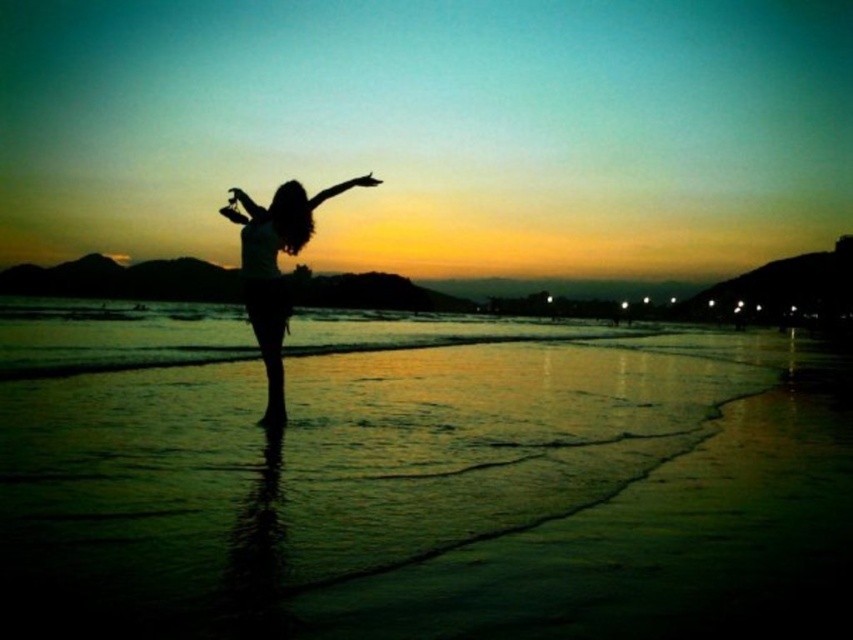
Describe the element at coordinates (421, 483) in the screenshot. I see `green sand at center` at that location.

Where is `green sand at center`? This screenshot has height=640, width=853. green sand at center is located at coordinates (421, 483).